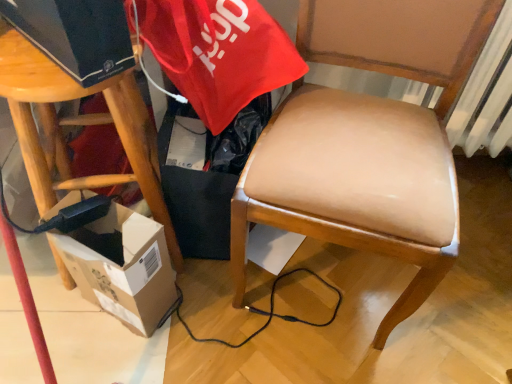
At what (x,y) coordinates should I click in order to perform the action: click on free spot in front of cardboard box at lower left. Please return your answer as a coordinate pair (x, y). Looking at the image, I should click on (121, 364).